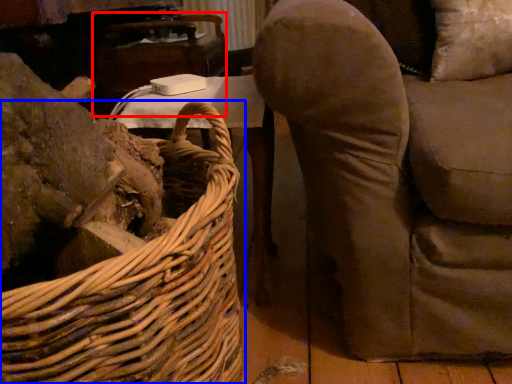
Question: Which point is closer to the camera, table (highlighted by a red box) or picnic basket (highlighted by a blue box)?

Choices:
 (A) table
 (B) picnic basket

Answer: (B)